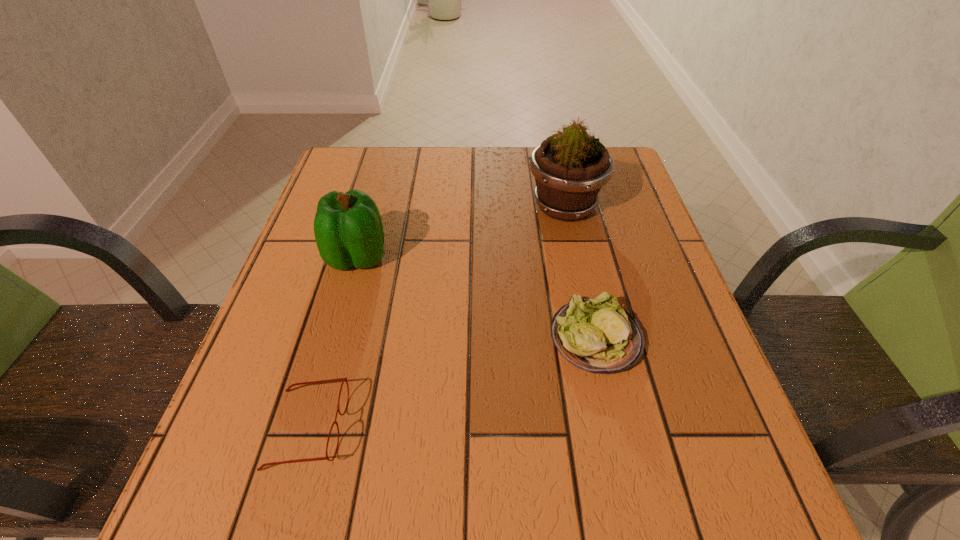
You are a GUI agent. You are given a task and a screenshot of the screen. Output one action in this format:
    pyautogui.click(x=<x>, y=<y>)
    Task: Click on the tallest object
    This screenshot has width=960, height=540.
    Given the screenshot: What is the action you would take?
    pyautogui.click(x=570, y=167)

This screenshot has width=960, height=540. Identify the location of the farthest object. [x=570, y=167].

This screenshot has width=960, height=540. In order to click on the second farthest object in this screenshot , I will do `click(348, 229)`.

This screenshot has height=540, width=960. In order to click on the second tallest object in this screenshot , I will do `click(348, 229)`.

The width and height of the screenshot is (960, 540). I want to click on the third farthest object, so click(x=597, y=336).

Where is `the third tallest object`? the third tallest object is located at coordinates (597, 336).

In order to click on spectacles in this screenshot , I will do `click(340, 379)`.

Where is `the nearest object`? The height and width of the screenshot is (540, 960). the nearest object is located at coordinates (340, 379).

You are a GUI agent. You are given a task and a screenshot of the screen. Output one action in this format:
    pyautogui.click(x=<x>, y=<y>)
    Task: Click on the vacant space situated on the left of the farthest object
    
    Given the screenshot: What is the action you would take?
    pyautogui.click(x=401, y=206)

Identify the location of free region located 0.050m on the front of the bell pepper. (346, 298).